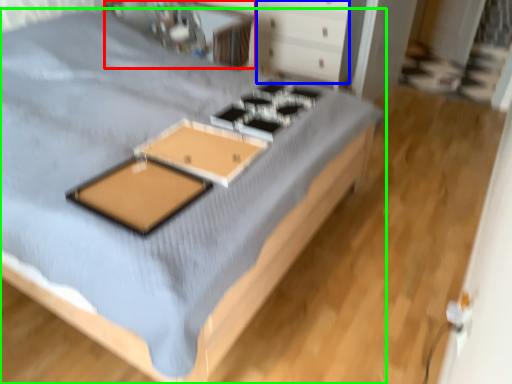
Question: Which object is the farthest from table (highlighted by a red box)? Choose among these: drawer (highlighted by a blue box) or bed (highlighted by a green box).

Choices:
 (A) drawer
 (B) bed

Answer: (B)